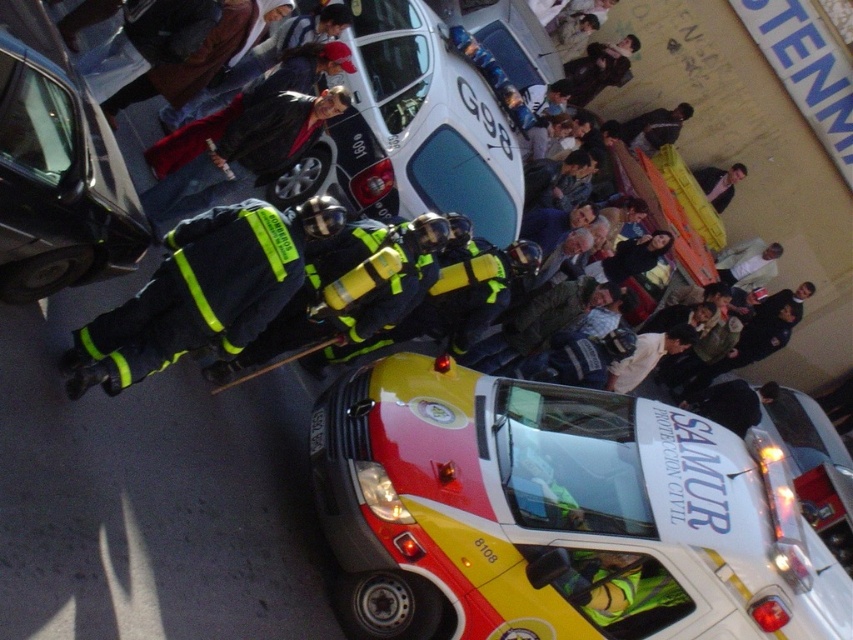
Question: Which point appears closest to the camera in this image?

Choices:
 (A) (668, 588)
 (B) (743, 176)

Answer: (A)

Question: Can you confirm if yellow and red plastic car at center is positioned above dark blue fabric uniform at left?

Choices:
 (A) yes
 (B) no

Answer: (B)

Question: Is yellow and red plastic car at center in front of shiny black car at center?

Choices:
 (A) no
 (B) yes

Answer: (A)

Question: Which of the following is the farthest from the observer?

Choices:
 (A) dark blue uniform at center
 (B) shiny black car at center

Answer: (A)

Question: Which point appears farthest from the camera in this image?

Choices:
 (A) (96, 218)
 (B) (720, 205)

Answer: (B)

Question: Can you confirm if yellow and red plastic car at center is positioned above dark blue uniform at center?

Choices:
 (A) yes
 (B) no

Answer: (B)